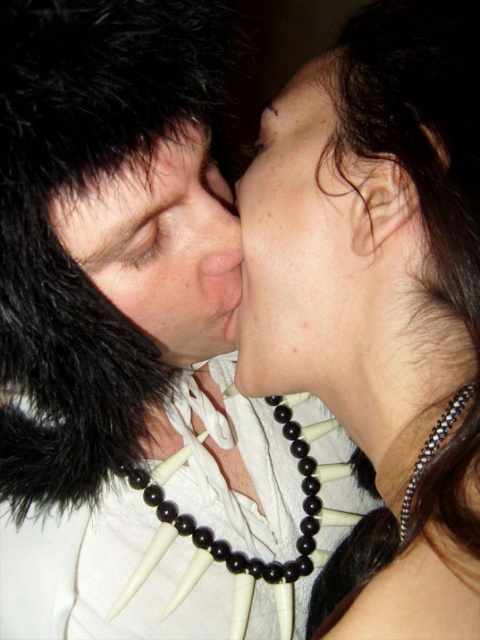
Question: Considering the real-world distances, which object is farthest from the black beaded necklace at upper center?

Choices:
 (A) black fur at upper left
 (B) smooth skin face at center

Answer: (A)

Question: Can you confirm if black beaded necklace at center is bigger than black fur at upper left?

Choices:
 (A) yes
 (B) no

Answer: (A)

Question: Observing the image, what is the correct spatial positioning of black beaded necklace at center in reference to black fur at upper left?

Choices:
 (A) right
 (B) left

Answer: (A)

Question: Among these points, which one is nearest to the camera?

Choices:
 (A) (192, 630)
 (B) (194, 193)
 (C) (170, 346)

Answer: (B)

Question: Can you confirm if black beaded necklace at upper center is thinner than black beaded necklace at center?

Choices:
 (A) yes
 (B) no

Answer: (A)

Question: Which point appears farthest from the camera in this image?

Choices:
 (A) (288, 404)
 (B) (280, 193)
 (C) (95, 212)

Answer: (A)